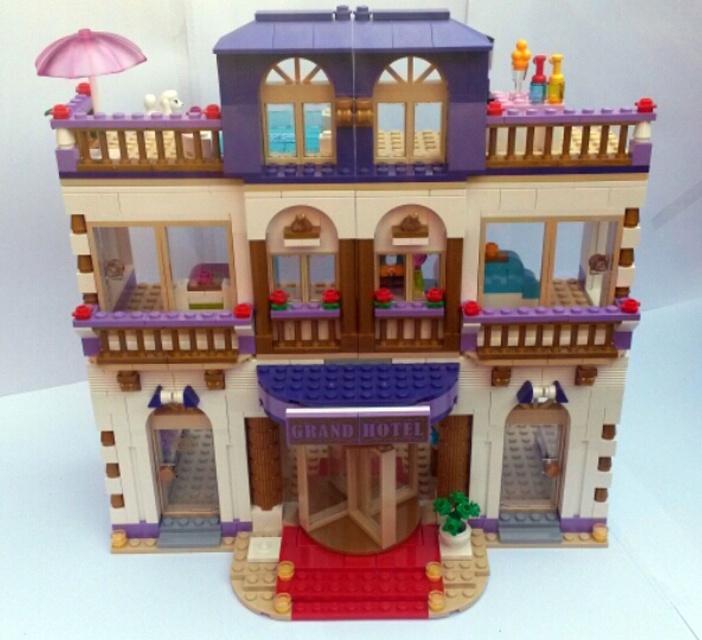
Does pink translucent umbrella at upper left have a greater height compared to translucent yellow plastic cup at upper center?

Yes.

Who is more distant from viewer, (53, 76) or (552, 76)?

Point (552, 76)

Locate an element on the screen. This screenshot has width=702, height=640. pink translucent umbrella at upper left is located at coordinates (86, 58).

Which is below, translucent yellow plastic cup at upper center or pink plastic umbrella at upper left?

pink plastic umbrella at upper left

Does translucent yellow plastic cup at upper center have a greater width compared to pink plastic umbrella at upper left?

No.

Identify the location of translucent yellow plastic cup at upper center. Image resolution: width=702 pixels, height=640 pixels. (555, 81).

Which is behind, point (119, 68) or point (543, 58)?

Point (543, 58)

Who is more distant from viewer, (105, 51) or (529, 97)?

The point (529, 97) is more distant.

Locate an element on the screen. Image resolution: width=702 pixels, height=640 pixels. pink translucent umbrella at upper left is located at coordinates (86, 58).